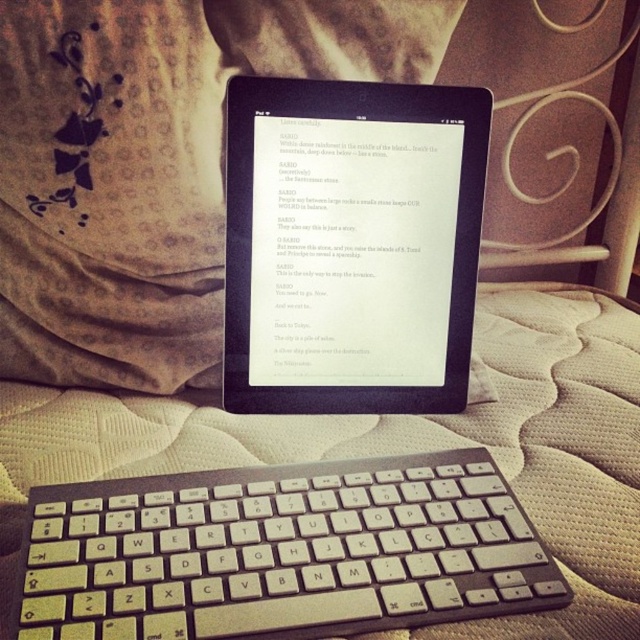
You are holding a 12 inch ruler and want to measure the distance between the point at coordinates point (312, 500) and the camera. Can your ruler reach that distance?

The distance between point (312, 500) and the camera is 19.18 inches. Since your ruler is only 12 inches long, it cannot reach the full distance. You would need a longer measuring tool.

You need to place both the white plastic keyboard at center and the black matte tablet at center on a shelf that can only hold items up to 30 cm in height. Which one is more likely to exceed the shelf height limit?

The black matte tablet at center is taller than the white plastic keyboard at center. Since the shelf has a height limit of 30 cm, the black matte tablet at center might exceed the limit while the keyboard might fit.

You are trying to place both the white plastic keyboard at center and the black matte tablet at center on a small shelf that can only hold items up to 12 inches in length. Given their sizes, can both items fit on the shelf if placed side by side?

The white plastic keyboard at center is bigger than the black matte tablet at center. Since the keyboard is larger, it might exceed the 12 inch limit when placed side by side with the tablet. Without exact measurements, it is uncertain if both will fit.